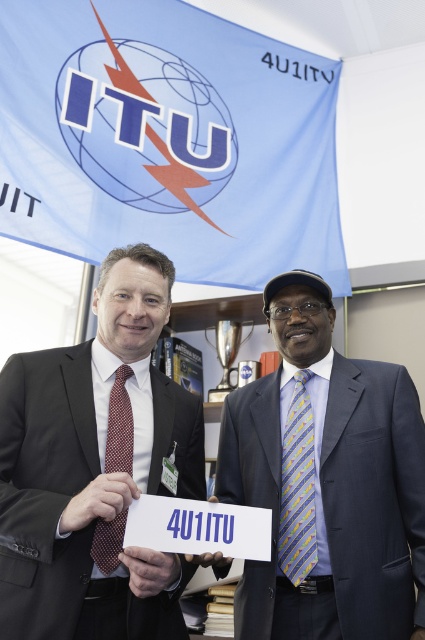
Question: Estimate the real-world distances between objects in this image. Which object is closer to the blue silk suit at center?

Choices:
 (A) matte black suit at center
 (B) yellow striped tie at center

Answer: (B)

Question: Is yellow striped tie at center wider than polka dot silk tie at center?

Choices:
 (A) yes
 (B) no

Answer: (A)

Question: Can you confirm if blue silk suit at center is bigger than matte black suit at center?

Choices:
 (A) yes
 (B) no

Answer: (A)

Question: Considering the relative positions of matte black suit at center and polka dot silk tie at center in the image provided, where is matte black suit at center located with respect to polka dot silk tie at center?

Choices:
 (A) above
 (B) below

Answer: (A)

Question: Based on their relative distances, which object is nearer to the polka dot silk tie at center?

Choices:
 (A) matte black suit at center
 (B) yellow striped tie at center

Answer: (A)

Question: Which of these objects is positioned farthest from the polka dot silk tie at center?

Choices:
 (A) matte black suit at center
 (B) yellow striped tie at center
 (C) blue silk suit at center

Answer: (C)